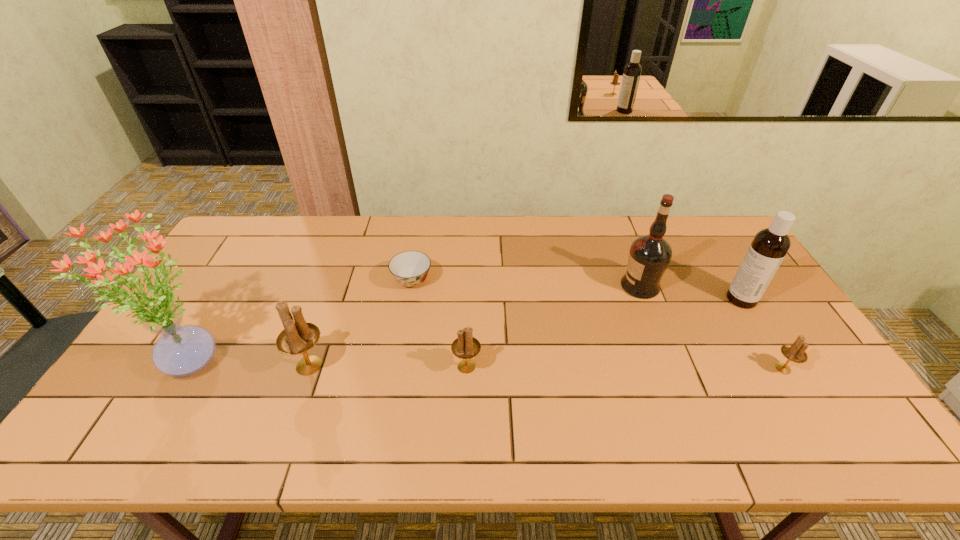
This screenshot has width=960, height=540. Find the location of `the second object from left to right`. the second object from left to right is located at coordinates pyautogui.click(x=297, y=338).

The image size is (960, 540). What are the coordinates of `the leftmost candle holder` in the screenshot? It's located at (297, 338).

Find the location of a particular element. The image size is (960, 540). the fourth object from right to left is located at coordinates (465, 347).

Find the location of `the second candle holder from right to left`. the second candle holder from right to left is located at coordinates (465, 347).

Where is `the shortest candle holder`? The image size is (960, 540). the shortest candle holder is located at coordinates (795, 352).

This screenshot has width=960, height=540. I want to click on the second shortest object, so click(795, 352).

At what (x,y) coordinates should I click in order to perform the action: click on the fifth object from left to right. Please return your answer as a coordinate pair (x, y). The image size is (960, 540). Looking at the image, I should click on (649, 256).

The image size is (960, 540). I want to click on soup bowl, so click(410, 268).

Identify the location of the shortest object. The image size is (960, 540). (410, 268).

Where is `the tallest object`? The image size is (960, 540). the tallest object is located at coordinates (182, 350).